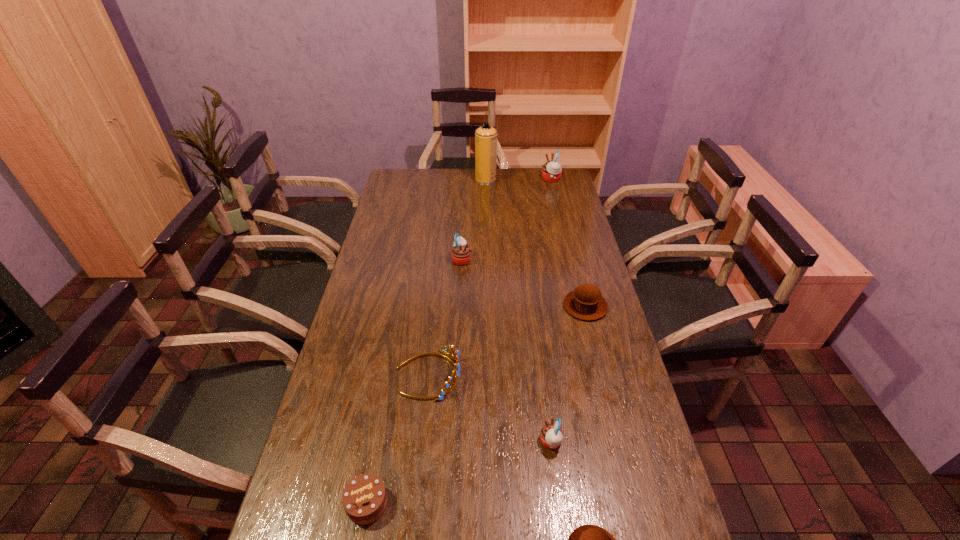
Locate an element on the screen. vacant space at the left edge of the desktop is located at coordinates (400, 202).

At what (x,y) coordinates should I click in order to perform the action: click on vacant space at the right edge. Please return your answer as a coordinate pair (x, y). The height and width of the screenshot is (540, 960). Looking at the image, I should click on point(635,416).

The height and width of the screenshot is (540, 960). In order to click on blank area at the far left corner in this screenshot , I will do `click(420, 171)`.

I want to click on free space at the far right corner of the desktop, so click(546, 181).

This screenshot has height=540, width=960. I want to click on free space between the aerosol can and the sixth farthest object, so click(x=518, y=311).

What are the coordinates of `vacant area between the second nearest object and the smallest pink muffin` in the screenshot? It's located at 459,472.

You are a GUI agent. You are given a task and a screenshot of the screen. Output one action in this format:
    pyautogui.click(x=<x>, y=<y>)
    Task: Click on the free space between the biggest pink muffin and the chocolate cake
    The height and width of the screenshot is (540, 960).
    Given the screenshot: What is the action you would take?
    [x=459, y=341]

At what (x,y) coordinates should I click in order to perform the action: click on blank region between the fourth nearest muffin and the smallest pink muffin. Please return your answer as a coordinate pair (x, y). This screenshot has height=540, width=960. Looking at the image, I should click on (506, 350).

Locate an element on the screen. The height and width of the screenshot is (540, 960). vacant space that is in between the third nearest muffin and the leftmost muffin is located at coordinates (523, 283).

This screenshot has height=540, width=960. I want to click on unoccupied position between the tallest object and the gold tiara, so click(x=457, y=278).